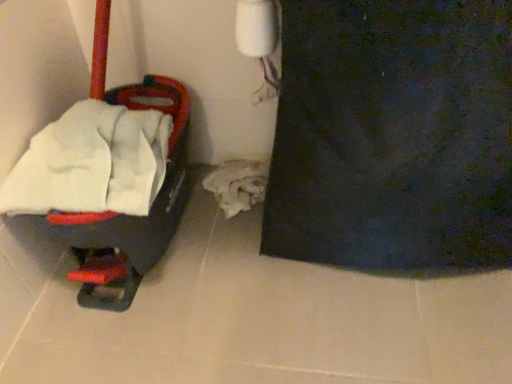
What do you see at coordinates (131, 216) in the screenshot?
I see `matte black baby carriage at left` at bounding box center [131, 216].

In order to face matte black baby carriage at left, should I rotate leftwards or rightwards?

Rotate your view left by about 16.980°.

Consider the image. What is the approximate height of matte black baby carriage at left?

matte black baby carriage at left is 10.11 inches tall.

You are a GUI agent. You are given a task and a screenshot of the screen. Output one action in this format:
    pyautogui.click(x=<x>, y=<y>)
    Task: Click on the matte black baby carriage at left
    The height and width of the screenshot is (384, 512).
    Given the screenshot: What is the action you would take?
    pyautogui.click(x=131, y=216)

In order to click on matte black baby carriage at left in this screenshot , I will do `click(131, 216)`.